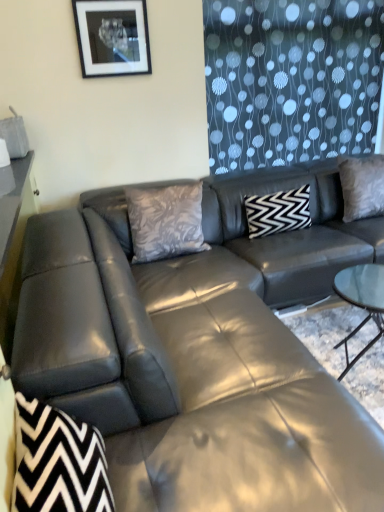
Question: Does point (367, 162) appear closer or farther from the camera than point (249, 226)?

Choices:
 (A) farther
 (B) closer

Answer: (A)

Question: From a real-world perspective, is silky gray pillow at upper right, the 1th pillow positioned from the right, physically located above or below black and white zigzag pillow at center, the 2th pillow viewed from the right?

Choices:
 (A) above
 (B) below

Answer: (A)

Question: Considering the real-world distances, which object is closest to the matte black picture frame at upper center?

Choices:
 (A) silky gray pillow at center, arranged as the third pillow when viewed from the right
 (B) matte black leather couch at center
 (C) black zigzag fabric swivel chair at lower left
 (D) black and white zigzag pillow at center, the 2th pillow viewed from the right
 (E) silky gray pillow at upper right, marked as the 3th pillow in a left-to-right arrangement

Answer: (A)

Question: Based on their relative distances, which object is farther from the matte black leather couch at center?

Choices:
 (A) matte black picture frame at upper center
 (B) silky gray pillow at upper right, the 1th pillow positioned from the right
 (C) silky gray pillow at center, which ranks as the 1th pillow in left-to-right order
 (D) black and white zigzag pillow at center, acting as the second pillow starting from the left
 (E) black zigzag fabric swivel chair at lower left

Answer: (A)